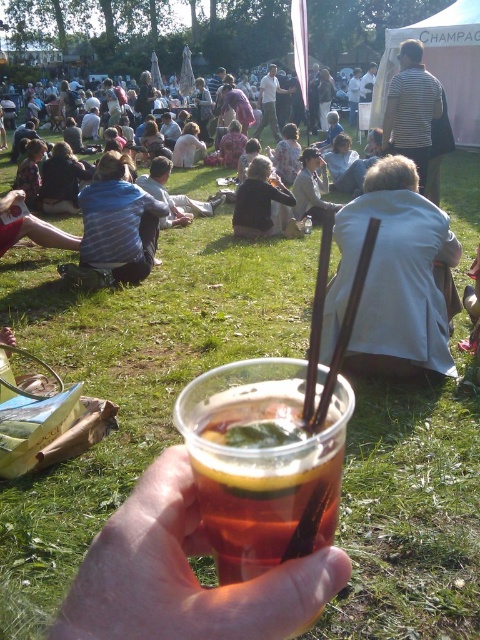
You are a photographer at the event and need to capture a photo that includes both the blue striped shirt at center and the light beige cotton shirt at center. The camera you have can focus on subjects within a 10 meter range. Will you be able to capture both shirts in the same photo?

The blue striped shirt at center and light beige cotton shirt at center are 11.21 meters apart, which exceeds the camera focus range of 10 meters. Therefore, you cannot capture both shirts in the same photo.